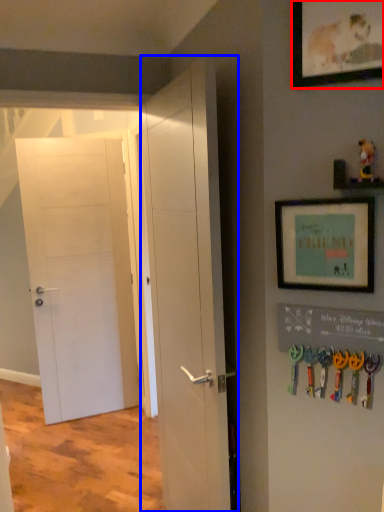
Question: Among these objects, which one is nearest to the camera, picture frame (highlighted by a red box) or door (highlighted by a blue box)?

Choices:
 (A) picture frame
 (B) door

Answer: (A)